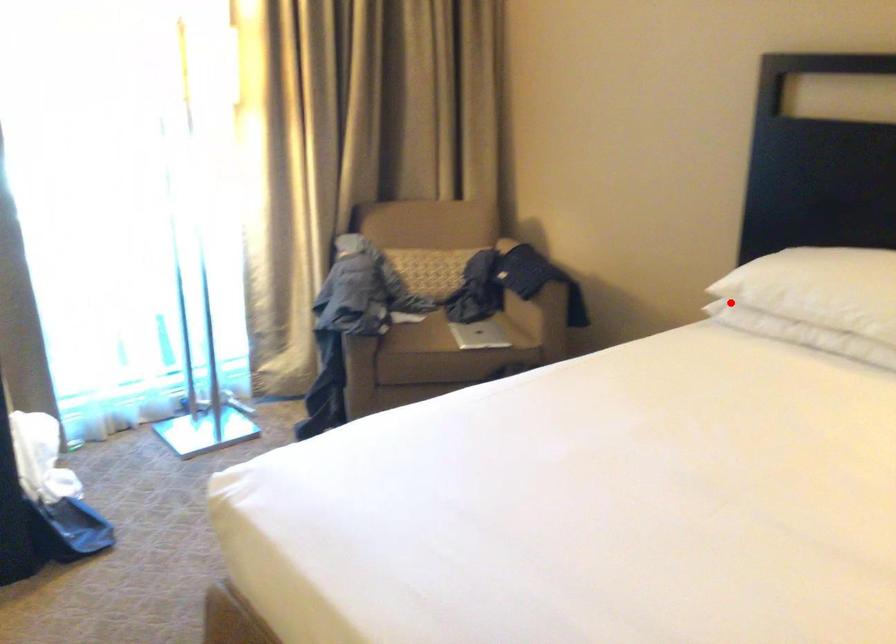
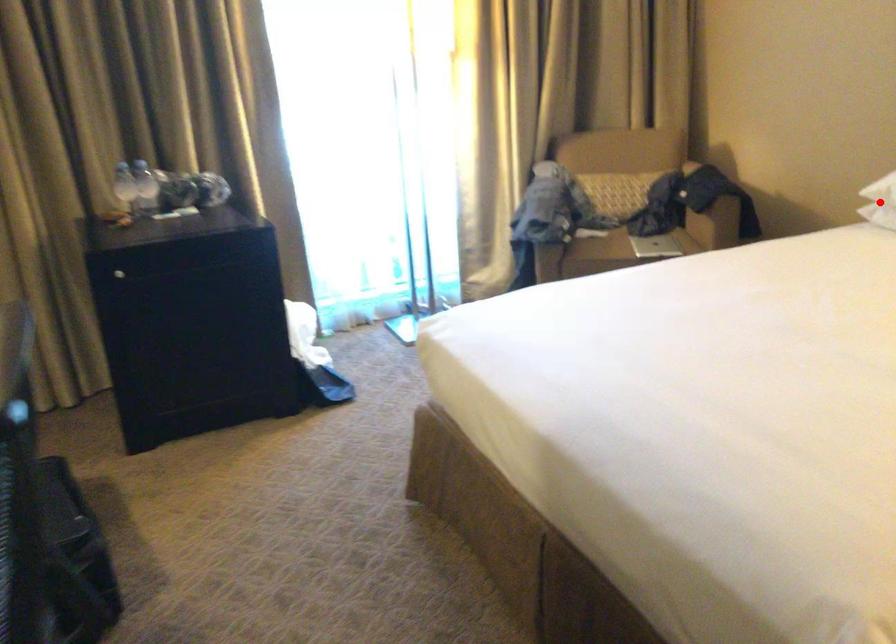
I am providing you with two images of the same scene from different viewpoints. A red point is marked on the first image and another point is marked on the second image. Is the marked point in image1 the same physical position as the marked point in image2?

Yes